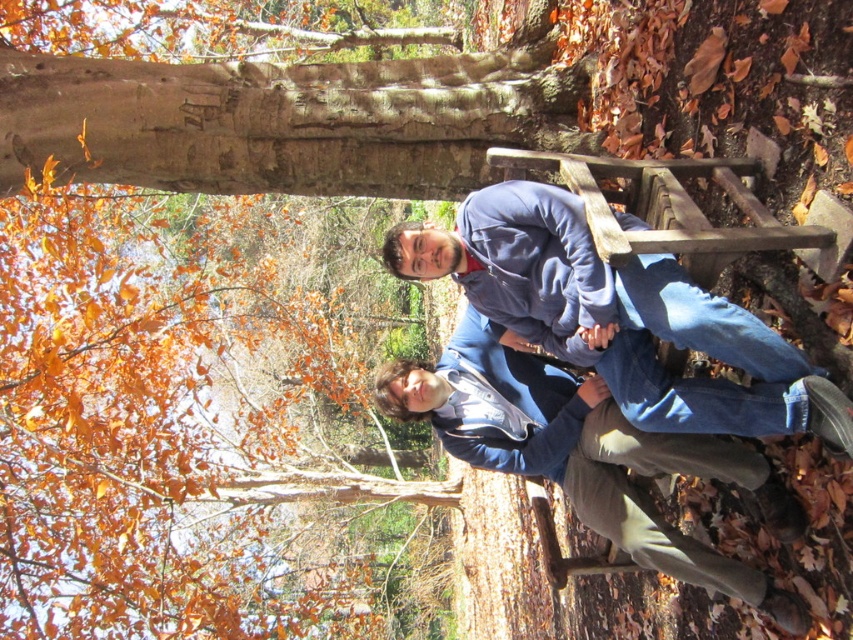
You are a photographer trying to capture both the blue fleece jacket at center and the blue denim jacket at center in a single frame. Since the camera has a limited focus range, you need to know which jacket is narrower to ensure both fit. Which jacket has a smaller width?

The blue fleece jacket at center has a smaller width than the blue denim jacket at center.